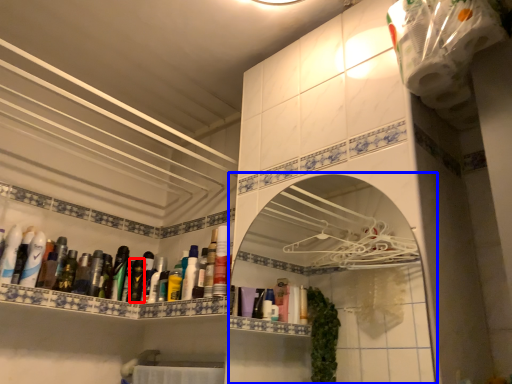
Question: Which of the following is the farthest to the observer, mouthwash (highlighted by a red box) or medicine cabinet (highlighted by a blue box)?

Choices:
 (A) mouthwash
 (B) medicine cabinet

Answer: (A)